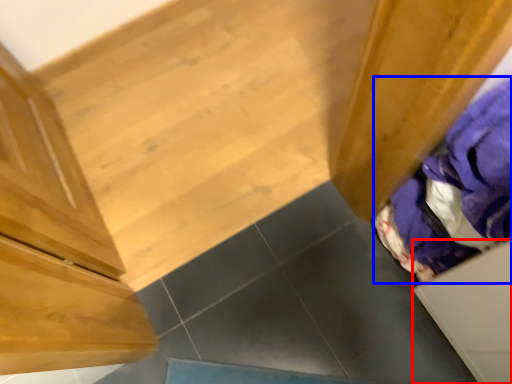
Question: Which object appears farthest to the camera in this image, drawer (highlighted by a red box) or clothing (highlighted by a blue box)?

Choices:
 (A) drawer
 (B) clothing

Answer: (B)